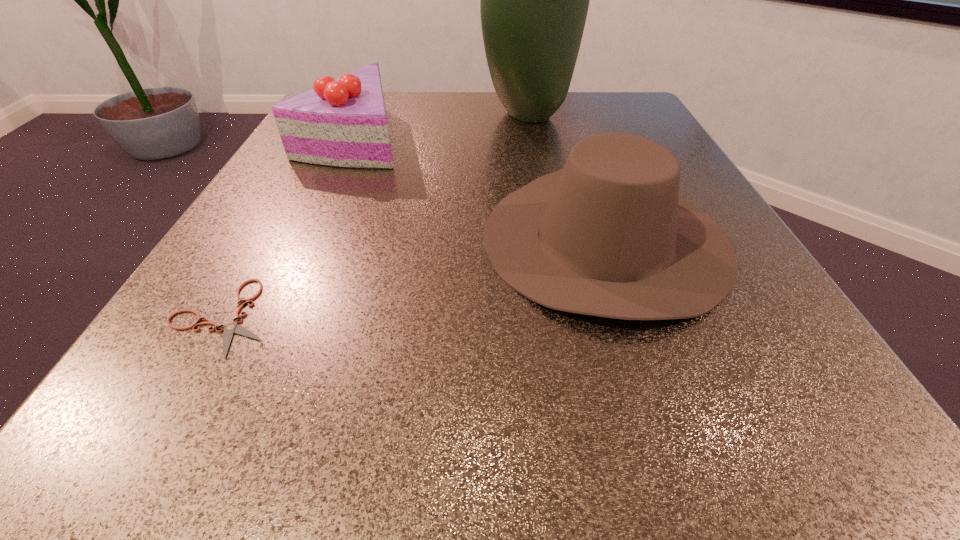
This screenshot has height=540, width=960. Identify the location of free spot between the cowboy hat and the shears. (414, 278).

I want to click on empty space between the cowboy hat and the cake, so click(x=479, y=187).

You are a GUI agent. You are given a task and a screenshot of the screen. Output one action in this format:
    pyautogui.click(x=<x>, y=<y>)
    Task: Click on the free spot between the shears and the cake
    The height and width of the screenshot is (540, 960).
    Given the screenshot: What is the action you would take?
    pyautogui.click(x=288, y=227)

Locate an element on the screen. The height and width of the screenshot is (540, 960). vacant space in between the cake and the vase is located at coordinates (441, 125).

This screenshot has height=540, width=960. In order to click on vacant area between the shortest object and the tallest object in this screenshot , I will do click(x=375, y=216).

Locate an element on the screen. The height and width of the screenshot is (540, 960). vacant space that is in between the shortest object and the tallest object is located at coordinates (375, 216).

This screenshot has height=540, width=960. What are the coordinates of `free space between the vase and the cake` in the screenshot? It's located at [x=441, y=125].

The height and width of the screenshot is (540, 960). Find the location of `vacant region between the cake and the shears`. vacant region between the cake and the shears is located at coordinates (288, 227).

Locate an element on the screen. The height and width of the screenshot is (540, 960). object identified as the closest to the vase is located at coordinates (342, 122).

Where is `object that stands as the closest to the cowboy hat`? This screenshot has height=540, width=960. object that stands as the closest to the cowboy hat is located at coordinates (534, 0).